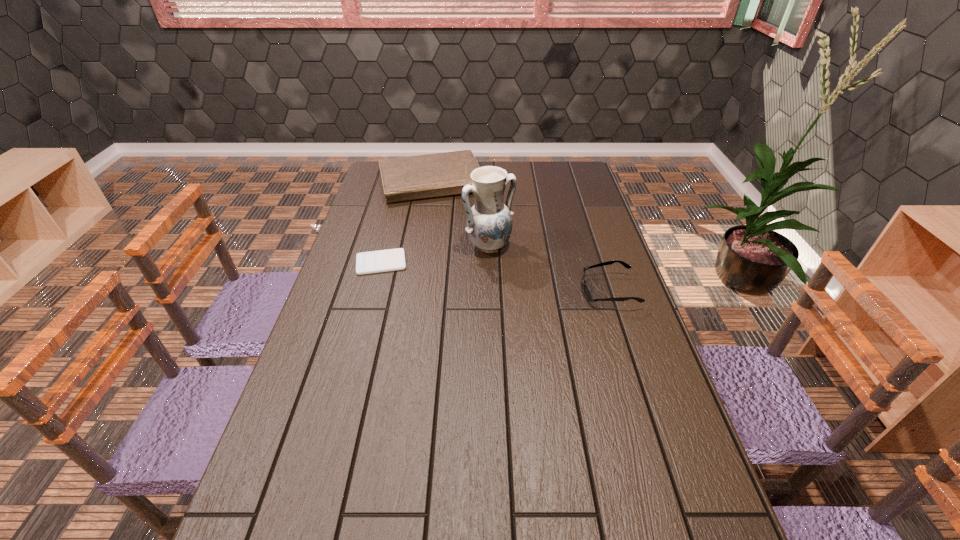
I want to click on object that is at the far left corner, so click(x=441, y=174).

You are a GUI agent. You are given a task and a screenshot of the screen. Output one action in this format:
    pyautogui.click(x=<x>, y=<y>)
    Task: Click on the vacant space at the near edge of the desktop
    
    Given the screenshot: What is the action you would take?
    pyautogui.click(x=465, y=495)

This screenshot has width=960, height=540. Find the location of `free spot at the left edge of the desktop`. free spot at the left edge of the desktop is located at coordinates (317, 393).

Image resolution: width=960 pixels, height=540 pixels. Identify the location of blank space at the right edge. (593, 227).

The width and height of the screenshot is (960, 540). Identify the location of free space at the near left corner of the desktop. (276, 489).

The image size is (960, 540). Identify the location of blank region between the shortest object and the pottery. (435, 254).

Locate an element on the screen. Image resolution: width=960 pixels, height=540 pixels. vacant area that lies between the tallest object and the paperback book is located at coordinates (462, 214).

What are the coordinates of `empty space between the pottery and the paperback book` in the screenshot? It's located at (462, 214).

Locate an element on the screen. free space between the second shortest object and the calculator is located at coordinates (494, 277).

I want to click on free space between the second tallest object and the calculator, so click(x=408, y=222).